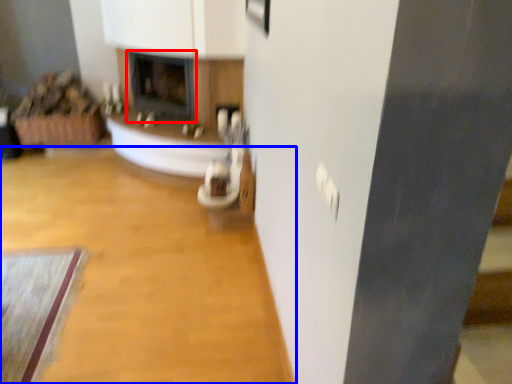
Question: Which object appears closest to the camera in this image, fireplace (highlighted by a red box) or plain (highlighted by a blue box)?

Choices:
 (A) fireplace
 (B) plain

Answer: (B)